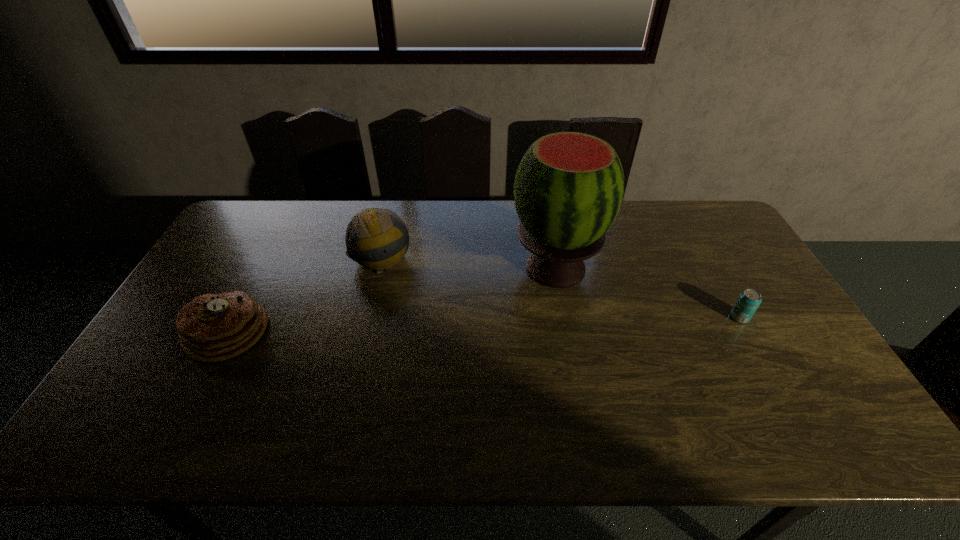
Where is `the second object from right to left`? The width and height of the screenshot is (960, 540). the second object from right to left is located at coordinates pos(569,187).

The width and height of the screenshot is (960, 540). What are the coordinates of `the tallest object` in the screenshot? It's located at (569, 187).

The width and height of the screenshot is (960, 540). Identify the location of the second object from left to right. (376, 238).

Identify the location of the third shortest object. This screenshot has height=540, width=960. (376, 238).

You are a GUI agent. You are given a task and a screenshot of the screen. Output one action in this format:
    pyautogui.click(x=<x>, y=<y>)
    Task: Click on the pancake
    
    Given the screenshot: What is the action you would take?
    pyautogui.click(x=211, y=328)

Where is `the leftmost object`? the leftmost object is located at coordinates (211, 328).

This screenshot has height=540, width=960. I want to click on the rightmost object, so click(x=749, y=300).

Where is `beer can`? Image resolution: width=960 pixels, height=540 pixels. beer can is located at coordinates (749, 300).

I want to click on free space located on the front of the watermelon, so click(x=574, y=371).

Image resolution: width=960 pixels, height=540 pixels. What are the coordinates of `vacant area situated 0.130m on the front of the third object from right to left` in the screenshot? It's located at (370, 312).